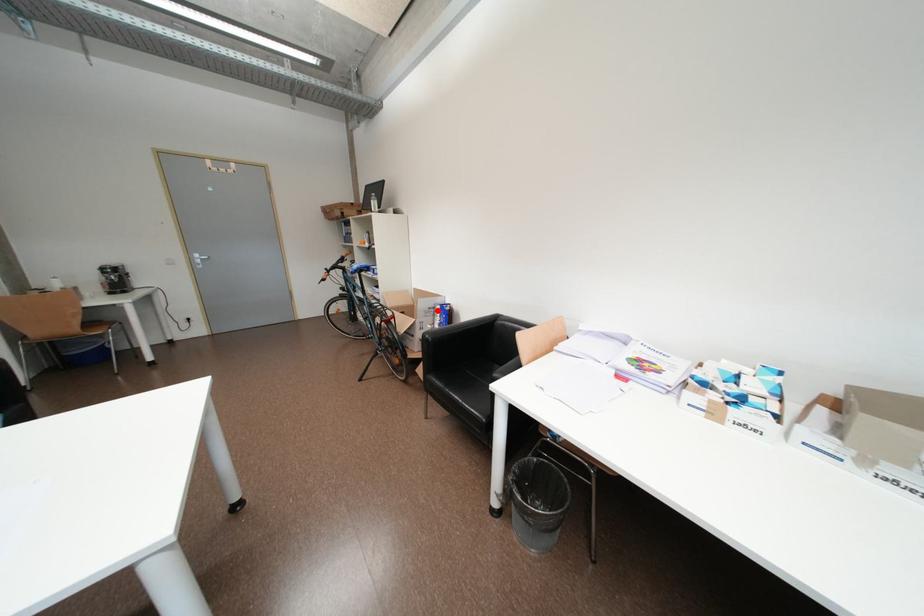
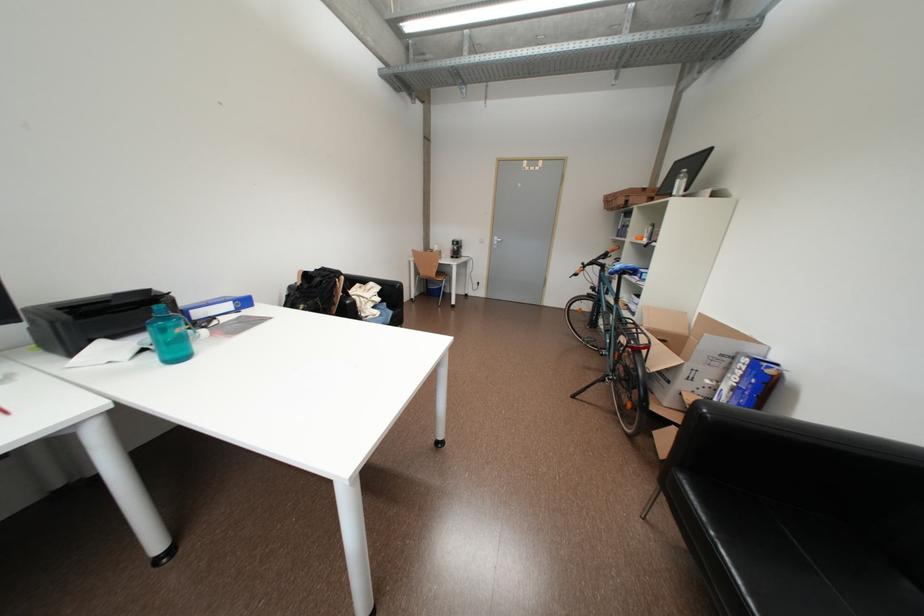
In the second image, find the point that corresponds to the highlighted location in the first image.

(731, 358)